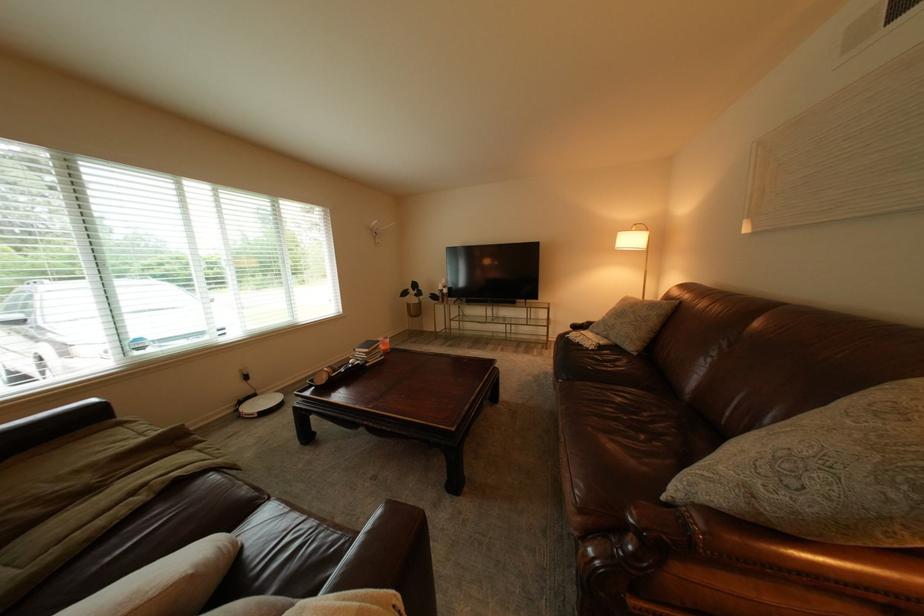
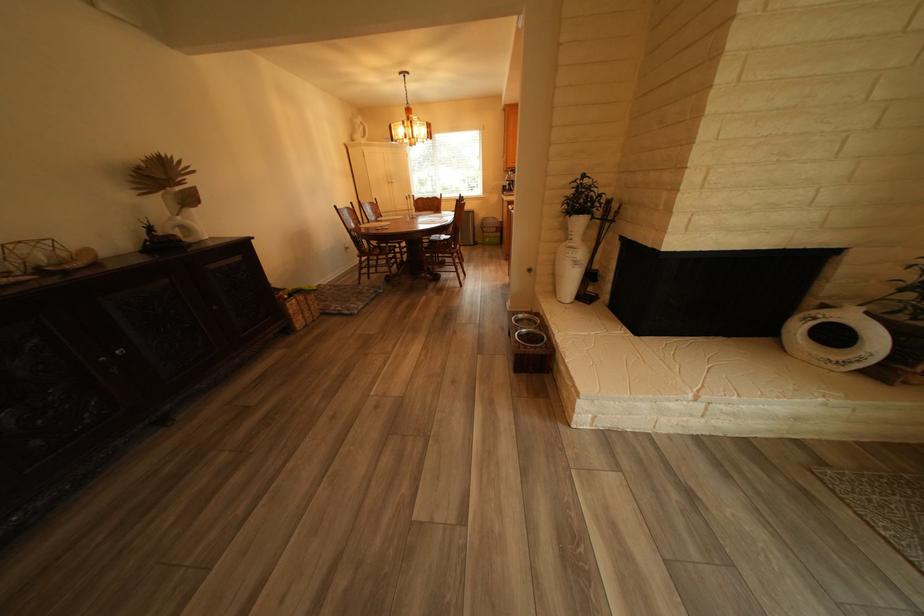
Which direction would the cameraman need to move to produce the second image?

The cameraman walked toward right, backward.